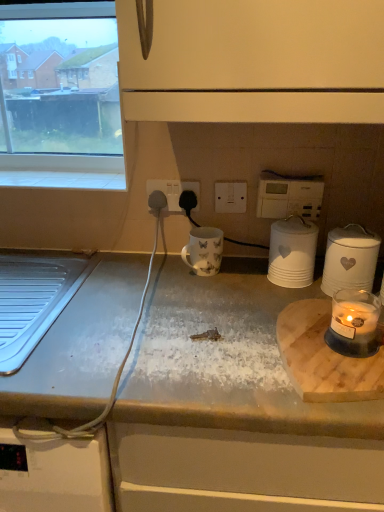
Question: Considering the positions of point [x=150, y=189] and point [x=276, y=276], is point [x=150, y=189] closer or farther from the camera than point [x=276, y=276]?

Choices:
 (A) farther
 (B) closer

Answer: (A)

Question: Is white plastic socket at center, the first electric outlet when ordered from left to right, situated inside white matte canister at center-right, placed as the second kitchen appliance when sorted from right to left, or outside?

Choices:
 (A) inside
 (B) outside

Answer: (B)

Question: Which of these objects is positioned farthest from the white plastic switch at center, which appears as the second electric outlet when viewed from the left?

Choices:
 (A) white plastic socket at center, marked as the 2th electric outlet in a right-to-left arrangement
 (B) white marble countertop at center
 (C) white glossy mug at center
 (D) white plastic thermostat at upper right
 (E) white ceramic jar at right, which ranks as the first kitchen appliance in right-to-left order

Answer: (B)

Question: Which object is positioned farthest from the white tile at upper left?

Choices:
 (A) translucent glass candle at right
 (B) white marble countertop at center
 (C) white plastic thermostat at upper right
 (D) white plastic switch at center, placed as the 1th electric outlet when sorted from right to left
 (E) white matte canister at center-right, the first kitchen appliance when ordered from left to right

Answer: (A)